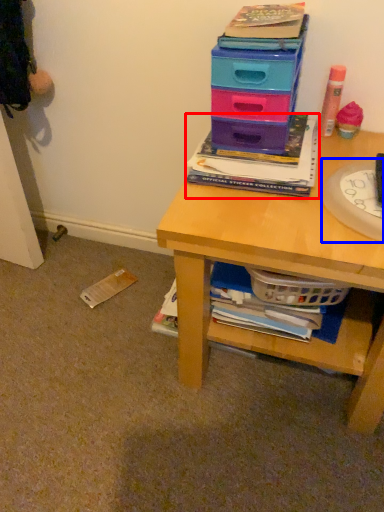
Question: Which point is closer to the camera, book (highlighted by a red box) or paper plate (highlighted by a blue box)?

Choices:
 (A) book
 (B) paper plate

Answer: (B)